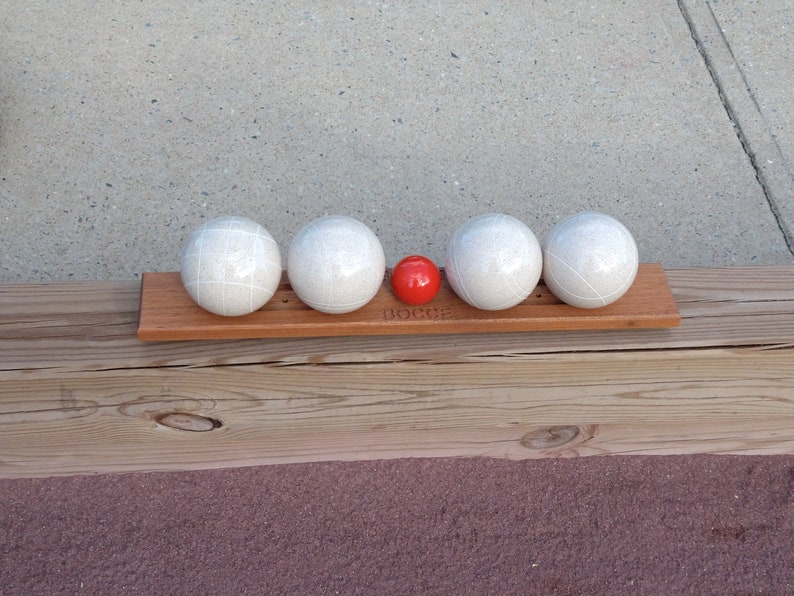
You are a GUI agent. You are given a task and a screenshot of the screen. Output one action in this format:
    pyautogui.click(x=<x>, y=<y>)
    Task: Click on the knot in wood
    This screenshot has height=596, width=794.
    Given the screenshot: What is the action you would take?
    pyautogui.click(x=557, y=439), pyautogui.click(x=212, y=425), pyautogui.click(x=120, y=406)